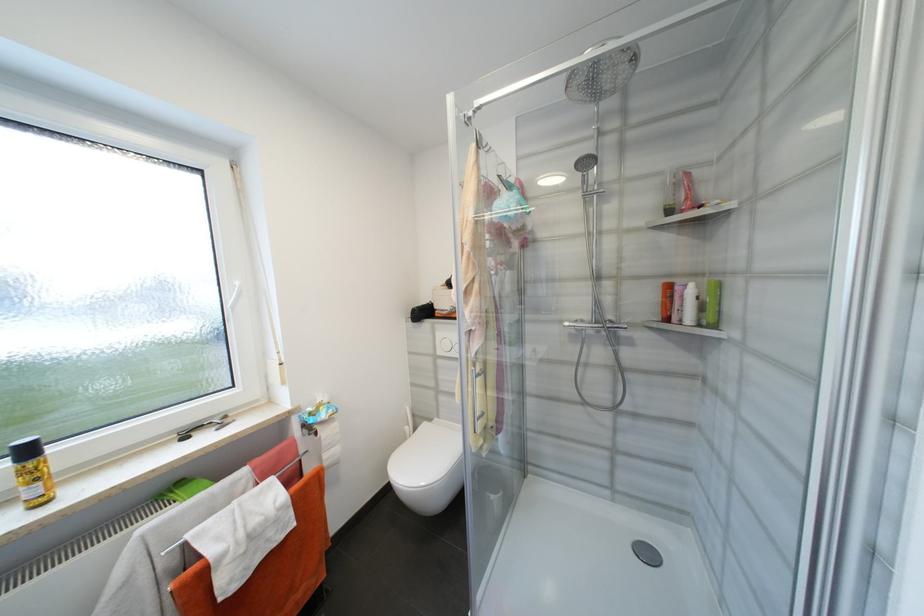
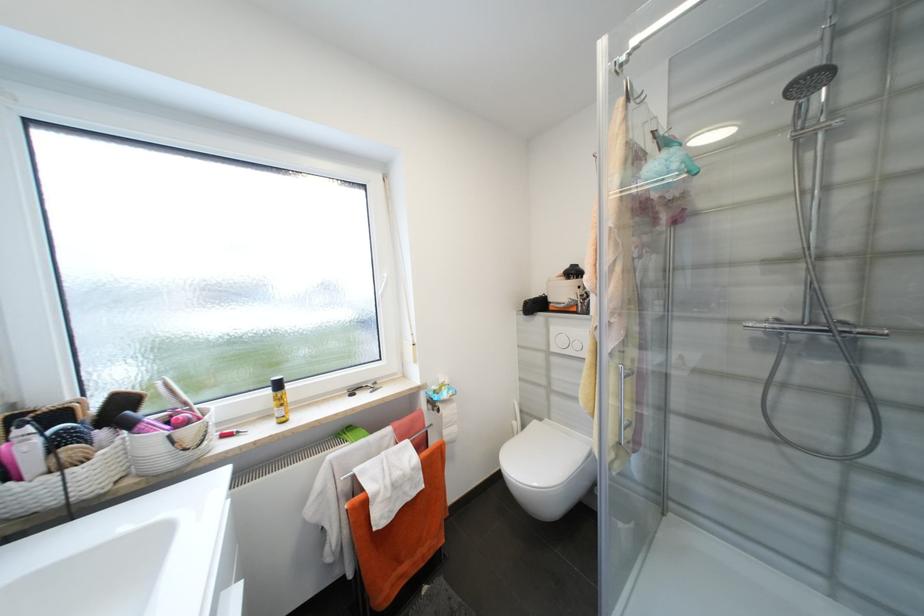
Locate, in the second image, the point that corresponds to (x=606, y=185) in the first image.

(839, 114)